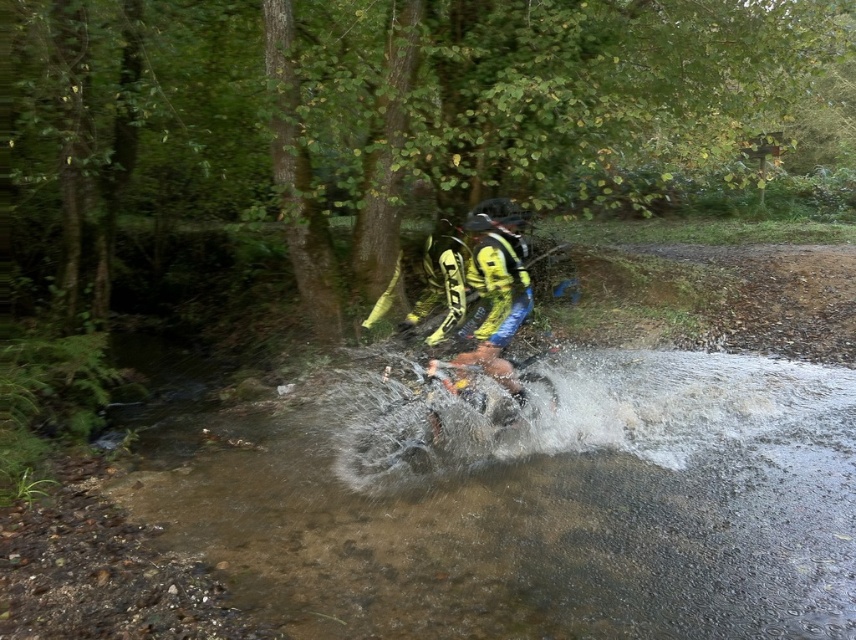
Can you confirm if clear water at center is taller than yellow/textured motorcycle at center?

In fact, clear water at center may be shorter than yellow/textured motorcycle at center.

This screenshot has height=640, width=856. I want to click on clear water at center, so click(x=532, y=504).

Which is behind, point (706, 360) or point (459, 364)?

Positioned behind is point (706, 360).

Where is `clear water at center`? This screenshot has width=856, height=640. clear water at center is located at coordinates (532, 504).